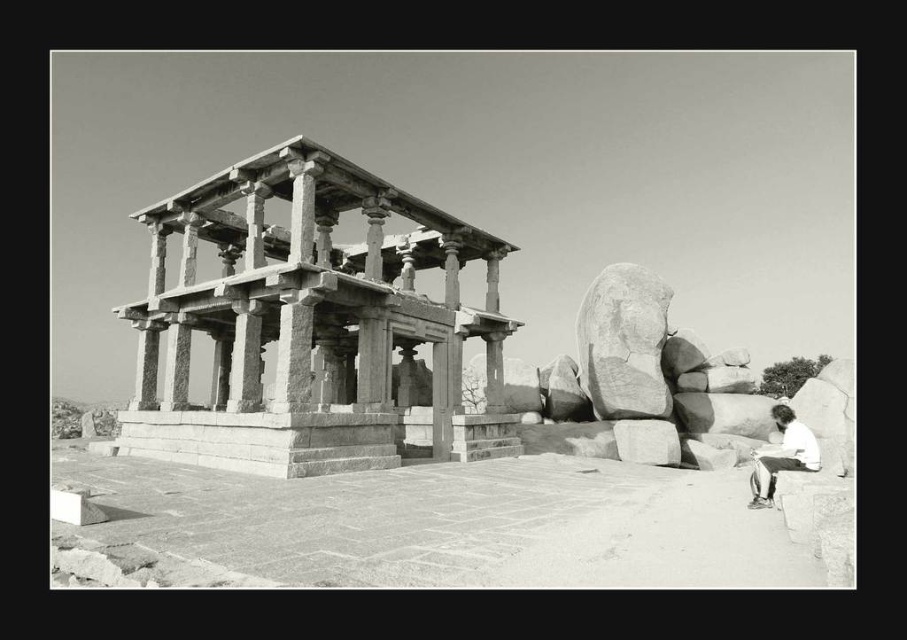
Question: Based on their relative distances, which object is nearer to the white cotton shirt at lower right?

Choices:
 (A) stone carved pavilion at center
 (B) smooth gray rock at center

Answer: (B)

Question: Estimate the real-world distances between objects in this image. Which object is closer to the stone carved pavilion at center?

Choices:
 (A) white cotton shirt at lower right
 (B) smooth gray rock at center

Answer: (B)

Question: Which point is farther from the camera taking this photo?

Choices:
 (A) (637, 298)
 (B) (340, 416)

Answer: (A)

Question: Is smooth gray rock at center in front of white cotton shirt at lower right?

Choices:
 (A) no
 (B) yes

Answer: (A)

Question: Does stone carved pavilion at center have a smaller size compared to white cotton shirt at lower right?

Choices:
 (A) yes
 (B) no

Answer: (B)

Question: Is stone carved pavilion at center above smooth gray rock at center?

Choices:
 (A) yes
 (B) no

Answer: (A)